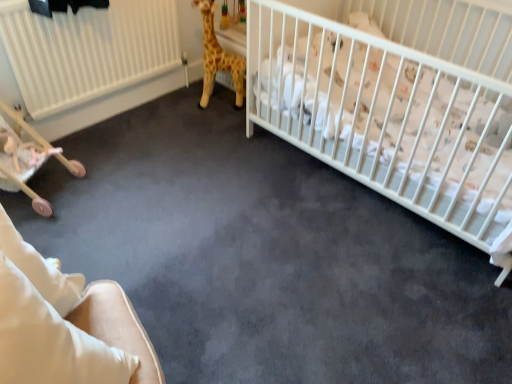
Question: Does point (265, 76) appear closer or farther from the camera than point (239, 74)?

Choices:
 (A) farther
 (B) closer

Answer: (B)

Question: In terms of height, does white matte crib at upper right look taller or shorter compared to yellow plush giraffe at upper center?

Choices:
 (A) short
 (B) tall

Answer: (B)

Question: Estimate the real-world distances between objects in this image. Which object is closer to the wooden baby carriage at lower left?

Choices:
 (A) white matte crib at upper right
 (B) pink plush toy at lower left
 (C) yellow plush giraffe at upper center
 (D) beige fabric rocking chair at lower left

Answer: (B)

Question: Which is farther from the beige fabric rocking chair at lower left?

Choices:
 (A) wooden baby carriage at lower left
 (B) yellow plush giraffe at upper center
 (C) pink plush toy at lower left
 (D) white matte crib at upper right

Answer: (B)